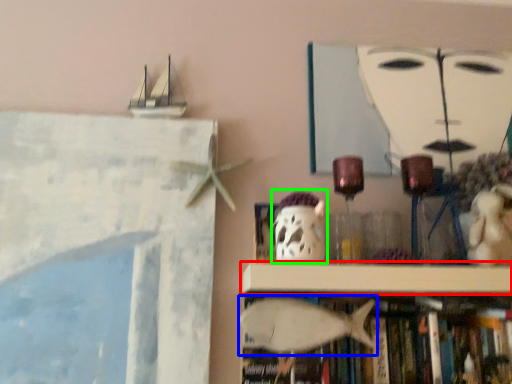
Question: Which is farther away from shelf (highlighted by a red box)? animal (highlighted by a blue box) or ghost (highlighted by a green box)?

Choices:
 (A) animal
 (B) ghost

Answer: (B)